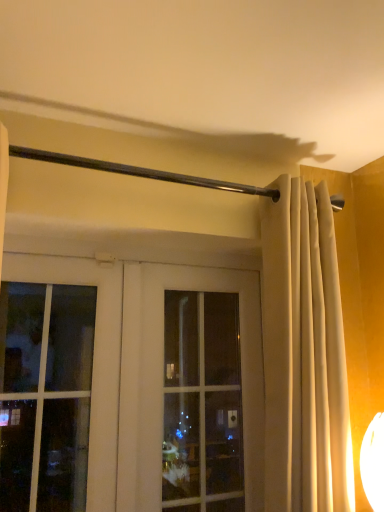
Question: Should I look upward or downward to see beige fabric curtain at center?

Choices:
 (A) down
 (B) up

Answer: (A)

Question: From a real-world perspective, is beige fabric curtain at center below white glass door at center?

Choices:
 (A) no
 (B) yes

Answer: (A)

Question: Considering the relative sizes of beige fabric curtain at center and white glass door at center in the image provided, is beige fabric curtain at center smaller than white glass door at center?

Choices:
 (A) yes
 (B) no

Answer: (B)

Question: Is beige fabric curtain at center at the right side of white glass door at center?

Choices:
 (A) no
 (B) yes

Answer: (B)

Question: Is beige fabric curtain at center thinner than white glass door at center?

Choices:
 (A) no
 (B) yes

Answer: (A)

Question: Is beige fabric curtain at center further to the viewer compared to white glass door at center?

Choices:
 (A) yes
 (B) no

Answer: (B)

Question: Considering the relative positions of beige fabric curtain at center and white glass door at center in the image provided, is beige fabric curtain at center to the left of white glass door at center from the viewer's perspective?

Choices:
 (A) yes
 (B) no

Answer: (B)

Question: Is clear glass window at center positioned far away from beige fabric curtain at center?

Choices:
 (A) yes
 (B) no

Answer: (B)

Question: Is the depth of clear glass window at center less than that of beige fabric curtain at center?

Choices:
 (A) no
 (B) yes

Answer: (A)

Question: Is the position of clear glass window at center more distant than that of beige fabric curtain at center?

Choices:
 (A) yes
 (B) no

Answer: (A)

Question: Does clear glass window at center have a greater width compared to beige fabric curtain at center?

Choices:
 (A) yes
 (B) no

Answer: (B)

Question: Does clear glass window at center have a lesser height compared to beige fabric curtain at center?

Choices:
 (A) no
 (B) yes

Answer: (B)

Question: Is clear glass window at center touching beige fabric curtain at center?

Choices:
 (A) yes
 (B) no

Answer: (B)

Question: From a real-world perspective, is clear glass window at center positioned over white glass door at center based on gravity?

Choices:
 (A) yes
 (B) no

Answer: (B)